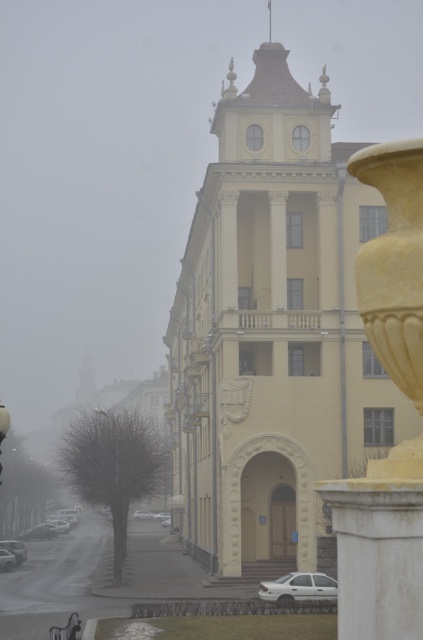
You are a pedestrian standing on the sidewalk in front of the beige building. You see a matte black car at lower left and a white matte car at lower left. Which car is closer to the left side of the sidewalk?

The matte black car at lower left is closer to the left side of the sidewalk because it is positioned to the left of the white matte car at lower left.